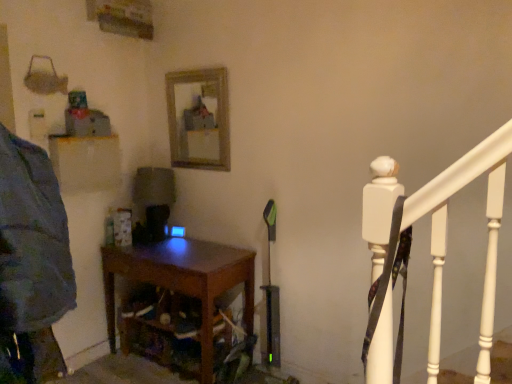
Question: Considering the relative sizes of wooden frame mirror at upper center and dark wood table at center in the image provided, is wooden frame mirror at upper center wider than dark wood table at center?

Choices:
 (A) yes
 (B) no

Answer: (B)

Question: Would you say dark wood table at center is part of wooden frame mirror at upper center's contents?

Choices:
 (A) no
 (B) yes

Answer: (A)

Question: From a real-world perspective, is wooden frame mirror at upper center on top of dark wood table at center?

Choices:
 (A) no
 (B) yes

Answer: (B)

Question: Can you confirm if wooden frame mirror at upper center is positioned to the right of dark wood table at center?

Choices:
 (A) yes
 (B) no

Answer: (A)

Question: Is the position of wooden frame mirror at upper center more distant than that of dark wood table at center?

Choices:
 (A) no
 (B) yes

Answer: (B)

Question: Is wooden frame mirror at upper center at the left side of dark wood table at center?

Choices:
 (A) no
 (B) yes

Answer: (A)

Question: From a real-world perspective, does dark wood table at center stand above wooden frame mirror at upper center?

Choices:
 (A) yes
 (B) no

Answer: (B)

Question: From the image's perspective, is dark wood table at center located beneath wooden frame mirror at upper center?

Choices:
 (A) no
 (B) yes

Answer: (B)

Question: Is dark wood table at center positioned beyond the bounds of wooden frame mirror at upper center?

Choices:
 (A) yes
 (B) no

Answer: (A)

Question: Does dark wood table at center have a larger size compared to wooden frame mirror at upper center?

Choices:
 (A) no
 (B) yes

Answer: (B)

Question: Could you tell me if dark wood table at center is facing wooden frame mirror at upper center?

Choices:
 (A) no
 (B) yes

Answer: (A)

Question: Is dark wood table at center further to the viewer compared to wooden frame mirror at upper center?

Choices:
 (A) no
 (B) yes

Answer: (A)

Question: Is dark wood table at center spatially inside wooden frame mirror at upper center, or outside of it?

Choices:
 (A) inside
 (B) outside

Answer: (B)